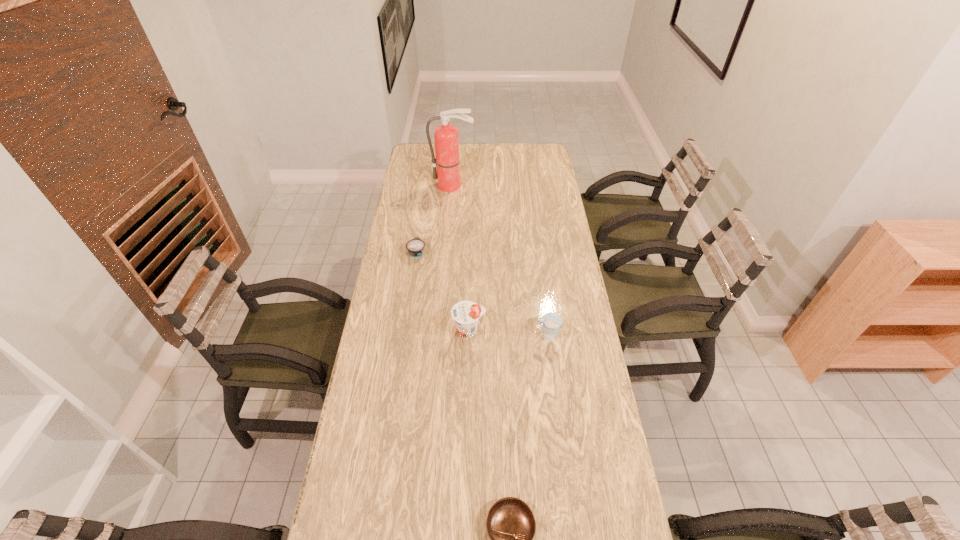
Image resolution: width=960 pixels, height=540 pixels. Find the location of `the tallest object`. the tallest object is located at coordinates (446, 137).

Where is `fire extinguisher`? Image resolution: width=960 pixels, height=540 pixels. fire extinguisher is located at coordinates (446, 137).

At what (x,y) coordinates should I click in order to perform the action: click on the second yogurt from right to left. Please return your answer as a coordinate pair (x, y). The height and width of the screenshot is (540, 960). Looking at the image, I should click on (466, 314).

The height and width of the screenshot is (540, 960). What are the coordinates of `the tallest yogurt` in the screenshot? It's located at (466, 314).

At what (x,y) coordinates should I click in order to perform the action: click on the rightmost yogurt. Please return your answer as a coordinate pair (x, y). This screenshot has height=540, width=960. Looking at the image, I should click on (551, 321).

Where is `the third shortest object`? the third shortest object is located at coordinates (551, 321).

This screenshot has width=960, height=540. In order to click on the farthest yogurt in this screenshot , I will do `click(415, 247)`.

The image size is (960, 540). Find the location of `the fourth nearest object`. the fourth nearest object is located at coordinates (415, 247).

At what (x,y) coordinates should I click in order to perform the action: click on blank space located with the handle and hose on the farthest object. Please return your answer as a coordinate pair (x, y). The image size is (960, 540). Looking at the image, I should click on pyautogui.click(x=449, y=235).

I want to click on vacant region located 0.310m on the front of the tallest yogurt, so click(x=468, y=430).